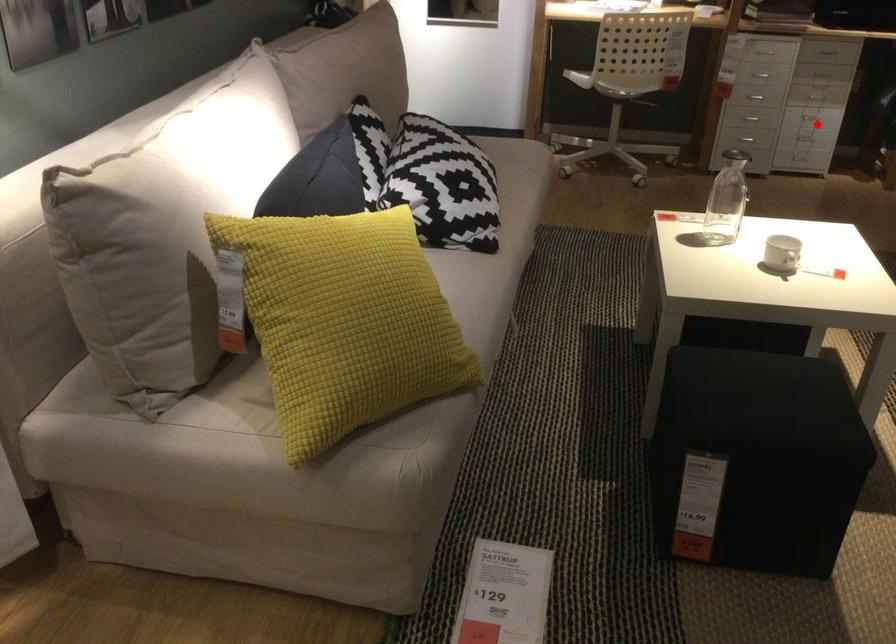
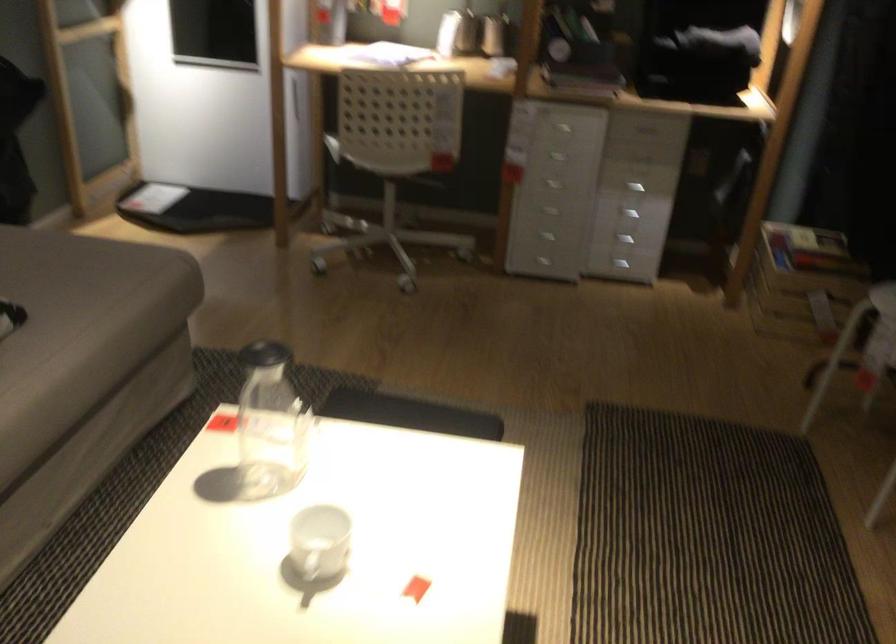
In the second image, find the point that corresponds to the highlighted location in the first image.

(625, 240)